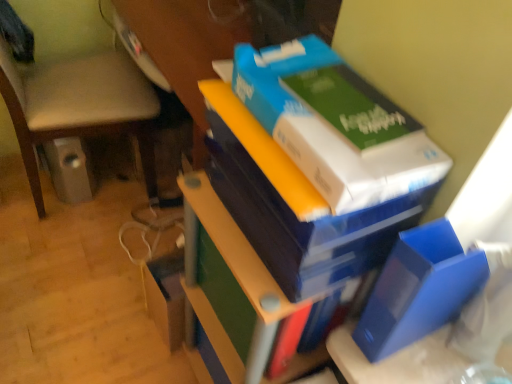
Where is `green matte paperback book at upper right, placed as the 2th paperback book when sorted from bottom to top`? green matte paperback book at upper right, placed as the 2th paperback book when sorted from bottom to top is located at coordinates (350, 105).

How much space does green matte paperback book at upper right, which is counted as the first paperback book, starting from the top, occupy vertically?

green matte paperback book at upper right, which is counted as the first paperback book, starting from the top, is 1.69 inches tall.

What do you see at coordinates (419, 289) in the screenshot? This screenshot has width=512, height=384. I see `blue matte folder at lower right, the 2th paperback book viewed from the top` at bounding box center [419, 289].

Where is `white cardboard box at upper right`? white cardboard box at upper right is located at coordinates (335, 124).

What do you see at coordinates (73, 100) in the screenshot? I see `beige fabric chair at lower left` at bounding box center [73, 100].

You are a GUI agent. You are given a task and a screenshot of the screen. Output one action in this format:
    pyautogui.click(x=<x>, y=<y>)
    Task: Click on the green matte paperback book at upper right, which is counted as the first paperback book, starting from the top
    The image size is (512, 384).
    Given the screenshot: What is the action you would take?
    pyautogui.click(x=350, y=105)

From the image's perspective, between blue cardboard box at upper right and green matte paperback book at upper right, placed as the 2th paperback book when sorted from bottom to top, which one is located above?

From the image's view, green matte paperback book at upper right, placed as the 2th paperback book when sorted from bottom to top, is above.

Considering the relative sizes of blue cardboard box at upper right and green matte paperback book at upper right, which is counted as the first paperback book, starting from the top, in the image provided, is blue cardboard box at upper right wider than green matte paperback book at upper right, which is counted as the first paperback book, starting from the top,?

Correct, the width of blue cardboard box at upper right exceeds that of green matte paperback book at upper right, which is counted as the first paperback book, starting from the top.

Considering the positions of point (418, 220) and point (355, 142), is point (418, 220) closer or farther from the camera than point (355, 142)?

Clearly, point (418, 220) is more distant from the camera than point (355, 142).

Considering the relative sizes of blue cardboard box at upper right and white cardboard box at upper right in the image provided, is blue cardboard box at upper right thinner than white cardboard box at upper right?

Incorrect, the width of blue cardboard box at upper right is not less than that of white cardboard box at upper right.

Considering the sizes of blue cardboard box at upper right and white cardboard box at upper right in the image, is blue cardboard box at upper right bigger or smaller than white cardboard box at upper right?

In the image, blue cardboard box at upper right appears to be larger than white cardboard box at upper right.

Is blue cardboard box at upper right not near white cardboard box at upper right?

blue cardboard box at upper right is near white cardboard box at upper right, not far away.

Between blue matte folder at lower right, which appears as the first paperback book when ordered from the bottom, and beige fabric chair at lower left, which one has larger width?

Wider between the two is beige fabric chair at lower left.

Based on their positions, is blue matte folder at lower right, the 2th paperback book viewed from the top, located to the left or right of beige fabric chair at lower left?

Clearly, blue matte folder at lower right, the 2th paperback book viewed from the top, is on the right of beige fabric chair at lower left in the image.

Is blue matte folder at lower right, which appears as the first paperback book when ordered from the bottom, aimed at beige fabric chair at lower left?

No, blue matte folder at lower right, which appears as the first paperback book when ordered from the bottom, is not turned towards beige fabric chair at lower left.

From the image's perspective, which one is positioned lower, blue matte folder at lower right, the 2th paperback book viewed from the top, or beige fabric chair at lower left?

blue matte folder at lower right, the 2th paperback book viewed from the top, from the image's perspective.

From a real-world perspective, who is located lower, green matte paperback book at upper right, placed as the 2th paperback book when sorted from bottom to top, or blue matte folder at lower right, which appears as the first paperback book when ordered from the bottom?

In real-world perspective, blue matte folder at lower right, which appears as the first paperback book when ordered from the bottom, is lower.

Could blue matte folder at lower right, which appears as the first paperback book when ordered from the bottom, be considered to be inside green matte paperback book at upper right, placed as the 2th paperback book when sorted from bottom to top?

No, blue matte folder at lower right, which appears as the first paperback book when ordered from the bottom, is not inside green matte paperback book at upper right, placed as the 2th paperback book when sorted from bottom to top.

Is the surface of green matte paperback book at upper right, which is counted as the first paperback book, starting from the top, in direct contact with blue matte folder at lower right, which appears as the first paperback book when ordered from the bottom?

There is a gap between green matte paperback book at upper right, which is counted as the first paperback book, starting from the top, and blue matte folder at lower right, which appears as the first paperback book when ordered from the bottom.

Looking at this image, is green matte paperback book at upper right, which is counted as the first paperback book, starting from the top, taller than blue matte folder at lower right, the 2th paperback book viewed from the top?

No, green matte paperback book at upper right, which is counted as the first paperback book, starting from the top, is not taller than blue matte folder at lower right, the 2th paperback book viewed from the top.

Is blue matte folder at lower right, which appears as the first paperback book when ordered from the bottom, aimed at blue cardboard box at upper right?

No, blue matte folder at lower right, which appears as the first paperback book when ordered from the bottom, is not aimed at blue cardboard box at upper right.

Can you confirm if blue matte folder at lower right, which appears as the first paperback book when ordered from the bottom, is smaller than blue cardboard box at upper right?

Correct, blue matte folder at lower right, which appears as the first paperback book when ordered from the bottom, occupies less space than blue cardboard box at upper right.

Between blue matte folder at lower right, the 2th paperback book viewed from the top, and blue cardboard box at upper right, which one is positioned behind?

blue matte folder at lower right, the 2th paperback book viewed from the top, is behind.

Is beige fabric chair at lower left bigger than blue matte folder at lower right, the 2th paperback book viewed from the top?

Indeed, beige fabric chair at lower left has a larger size compared to blue matte folder at lower right, the 2th paperback book viewed from the top.

Is beige fabric chair at lower left to the left or to the right of blue matte folder at lower right, the 2th paperback book viewed from the top, in the image?

beige fabric chair at lower left is positioned on blue matte folder at lower right, the 2th paperback book viewed from the top,'s left side.

This screenshot has width=512, height=384. Find the location of `chair lying above the blue matte folder at lower right, which appears as the first paperback book when ordered from the bottom (from the image's perspective)`. chair lying above the blue matte folder at lower right, which appears as the first paperback book when ordered from the bottom (from the image's perspective) is located at coordinates (73, 100).

Is the depth of beige fabric chair at lower left less than that of blue matte folder at lower right, the 2th paperback book viewed from the top?

No, the depth of beige fabric chair at lower left is greater than that of blue matte folder at lower right, the 2th paperback book viewed from the top.

Is white cardboard box at upper right not close to beige fabric chair at lower left?

white cardboard box at upper right is near beige fabric chair at lower left, not far away.

Is point (415, 149) more distant than point (121, 99)?

No, it is in front of (121, 99).

Can you confirm if white cardboard box at upper right is wider than beige fabric chair at lower left?

No.

Starting from the blue cardboard box at upper right, which paperback book is the 1st one behind? Please provide its 2D coordinates.

[(350, 105)]

I want to click on bookcase on the left side of white cardboard box at upper right, so [x=317, y=164].

Considering their positions, is blue matte folder at lower right, which appears as the first paperback book when ordered from the bottom, positioned further to green matte paperback book at upper right, which is counted as the first paperback book, starting from the top, than white cardboard box at upper right?

The object further to green matte paperback book at upper right, which is counted as the first paperback book, starting from the top, is blue matte folder at lower right, which appears as the first paperback book when ordered from the bottom.

From the picture: Which object lies further to the anchor point blue cardboard box at upper right, white cardboard box at upper right or green matte paperback book at upper right, which is counted as the first paperback book, starting from the top?

green matte paperback book at upper right, which is counted as the first paperback book, starting from the top.

Consider the image. From the image, which object appears to be farther from white cardboard box at upper right, blue cardboard box at upper right or beige fabric chair at lower left?

Among the two, beige fabric chair at lower left is located further to white cardboard box at upper right.

Which object lies further to the anchor point blue matte folder at lower right, which appears as the first paperback book when ordered from the bottom, white cardboard box at upper right or blue cardboard box at upper right?

The object further to blue matte folder at lower right, which appears as the first paperback book when ordered from the bottom, is white cardboard box at upper right.

Looking at the image, which one is located further to beige fabric chair at lower left, green matte paperback book at upper right, which is counted as the first paperback book, starting from the top, or blue cardboard box at upper right?

Among the two, green matte paperback book at upper right, which is counted as the first paperback book, starting from the top, is located further to beige fabric chair at lower left.

Considering their positions, is green matte paperback book at upper right, which is counted as the first paperback book, starting from the top, positioned closer to white cardboard box at upper right than blue matte folder at lower right, the 2th paperback book viewed from the top?

green matte paperback book at upper right, which is counted as the first paperback book, starting from the top.

Based on their spatial positions, is white cardboard box at upper right or beige fabric chair at lower left further from green matte paperback book at upper right, which is counted as the first paperback book, starting from the top?

The object further to green matte paperback book at upper right, which is counted as the first paperback book, starting from the top, is beige fabric chair at lower left.

Based on the photo, based on their spatial positions, is blue cardboard box at upper right or beige fabric chair at lower left closer to blue matte folder at lower right, which appears as the first paperback book when ordered from the bottom?

blue cardboard box at upper right is closer to blue matte folder at lower right, which appears as the first paperback book when ordered from the bottom.

Where is `paperback book situated between beige fabric chair at lower left and blue matte folder at lower right, which appears as the first paperback book when ordered from the bottom, from left to right`? paperback book situated between beige fabric chair at lower left and blue matte folder at lower right, which appears as the first paperback book when ordered from the bottom, from left to right is located at coordinates (350, 105).

The height and width of the screenshot is (384, 512). What are the coordinates of `bookcase between beige fabric chair at lower left and blue matte folder at lower right, which appears as the first paperback book when ordered from the bottom` in the screenshot? It's located at (317, 164).

This screenshot has width=512, height=384. Identify the location of bookcase situated between beige fabric chair at lower left and white cardboard box at upper right from left to right. (317, 164).

You are a GUI agent. You are given a task and a screenshot of the screen. Output one action in this format:
    pyautogui.click(x=<x>, y=<y>)
    Task: Click on the box between beige fabric chair at lower left and green matte paperback book at upper right, which is counted as the first paperback book, starting from the top, from left to right
    
    Given the screenshot: What is the action you would take?
    pyautogui.click(x=335, y=124)